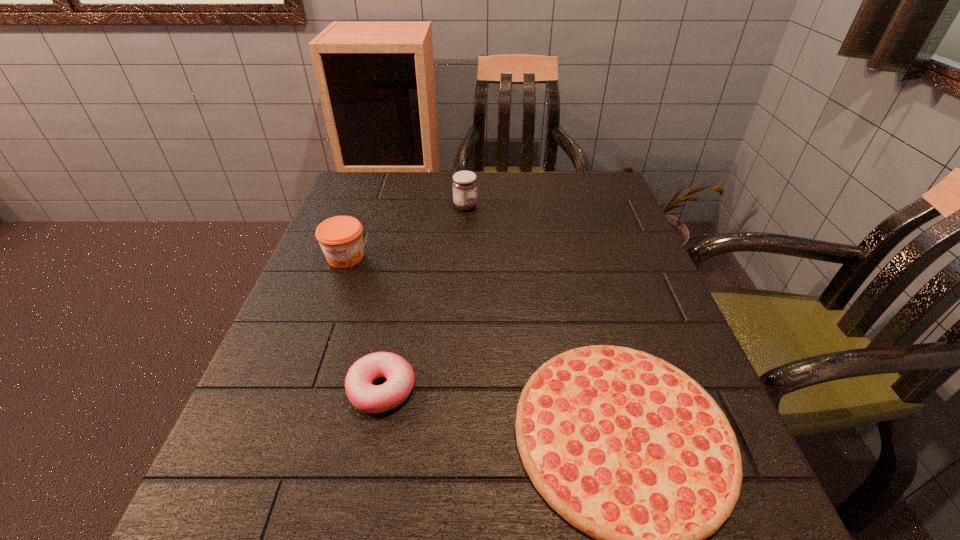
At what (x,y) coordinates should I click in order to perform the action: click on vacant region that satisfies the following two spatial constraints: 1. on the front label of the second object from right to left; 2. on the front label of the leftmost object. Please return your answer as a coordinate pair (x, y). Looking at the image, I should click on (463, 257).

Identify the location of vacant space that satisfies the following two spatial constraints: 1. on the front label of the right jam; 2. on the front side of the second object from left to right. (457, 389).